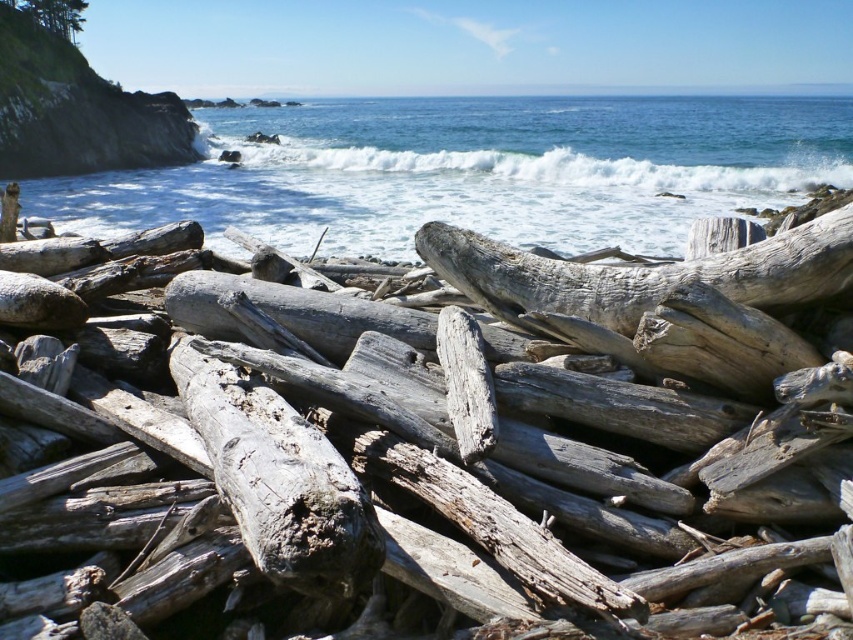
Question: Can you confirm if weathered wood at center is positioned below blue water at upper center?

Choices:
 (A) no
 (B) yes

Answer: (B)

Question: Can you confirm if weathered wood log at center is smaller than white frothy wave at upper center?

Choices:
 (A) no
 (B) yes

Answer: (B)

Question: Estimate the real-world distances between objects in this image. Which object is farther from the white frothy wave at upper center?

Choices:
 (A) weathered wood log at center
 (B) weathered wood at center
 (C) blue water at upper center

Answer: (A)

Question: Among these points, which one is farthest from the camera?

Choices:
 (A) (177, 600)
 (B) (483, 166)

Answer: (B)

Question: Can you confirm if weathered wood log at center is positioned to the right of white frothy wave at upper center?

Choices:
 (A) yes
 (B) no

Answer: (A)

Question: Based on their relative distances, which object is farther from the white frothy wave at upper center?

Choices:
 (A) weathered wood log at center
 (B) blue water at upper center
 (C) weathered wood at center

Answer: (A)